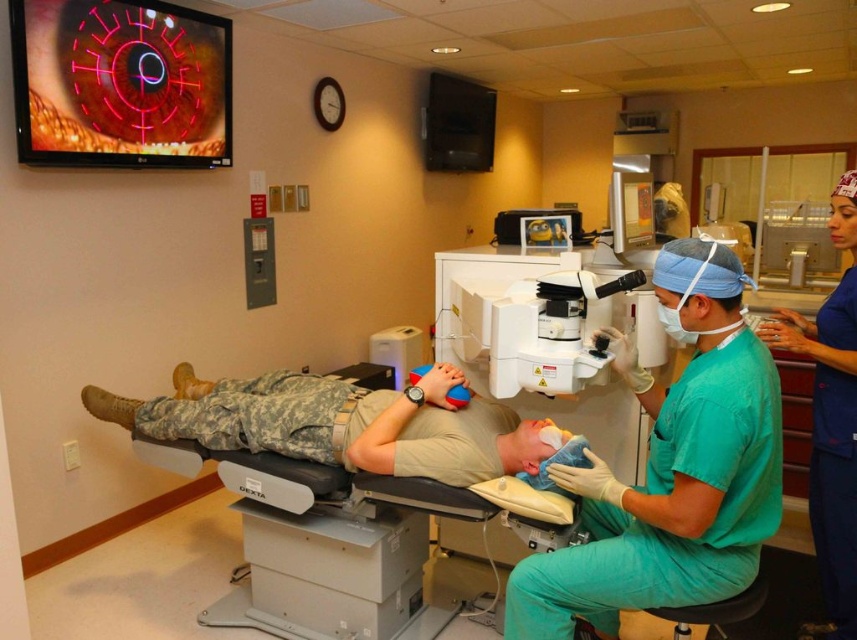
Question: Is the position of camouflage fabric uniform at center less distant than that of blue rubber glove at lower center?

Choices:
 (A) no
 (B) yes

Answer: (B)

Question: Considering the relative positions of camouflage fabric uniform at center and blue rubber glove at lower center in the image provided, where is camouflage fabric uniform at center located with respect to blue rubber glove at lower center?

Choices:
 (A) below
 (B) above

Answer: (A)

Question: Estimate the real-world distances between objects in this image. Which object is closer to the blue scrubs at right?

Choices:
 (A) camouflage fabric uniform at center
 (B) blue rubber glove at lower center

Answer: (B)

Question: Based on their relative distances, which object is nearer to the blue rubber glove at lower center?

Choices:
 (A) camouflage fabric uniform at center
 (B) green scrubs at center

Answer: (A)

Question: Among these points, which one is nearest to the camera?

Choices:
 (A) (268, 410)
 (B) (844, 339)
 (C) (681, 602)

Answer: (C)

Question: Does green scrubs at center have a greater width compared to blue scrubs at right?

Choices:
 (A) yes
 (B) no

Answer: (A)